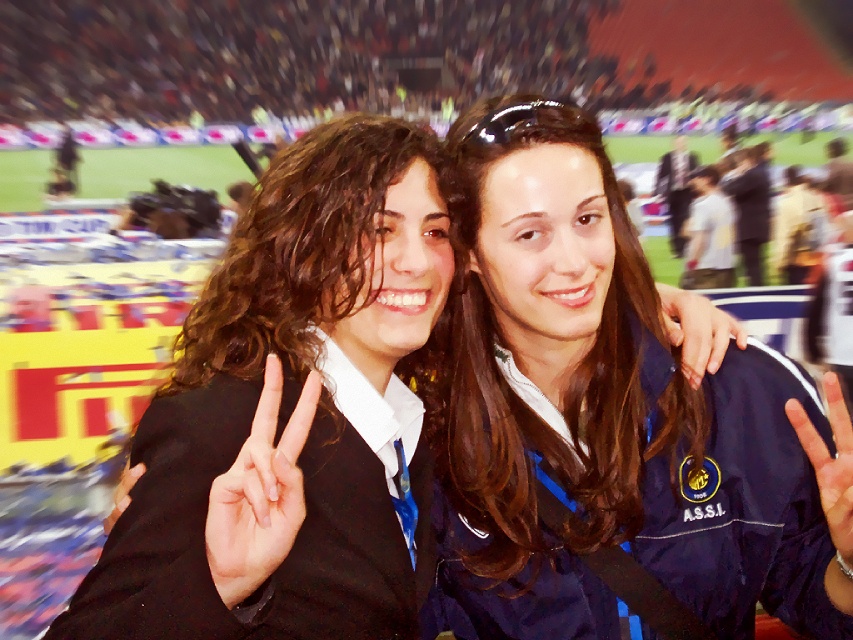
Which of these two, white matte hand at center or matte black hand at center, stands shorter?

With less height is matte black hand at center.

Does white matte hand at center have a lesser height compared to matte black hand at center?

No.

Locate an element on the screen. The height and width of the screenshot is (640, 853). white matte hand at center is located at coordinates (259, 492).

At what (x,y) coordinates should I click in order to perform the action: click on white matte hand at center. Please return your answer as a coordinate pair (x, y). Looking at the image, I should click on (259, 492).

Is blue fabric jacket at center smaller than light skin hand at center?

No.

Does blue fabric jacket at center appear over light skin hand at center?

Yes, blue fabric jacket at center is above light skin hand at center.

Which is behind, point (509, 614) or point (838, 461)?

Positioned behind is point (509, 614).

Locate an element on the screen. blue fabric jacket at center is located at coordinates coord(612,417).

Is black matte blazer at center wider than light skin hand at center?

Correct, the width of black matte blazer at center exceeds that of light skin hand at center.

Can you confirm if black matte blazer at center is bigger than light skin hand at center?

Indeed, black matte blazer at center has a larger size compared to light skin hand at center.

Does point (315, 499) come closer to viewer compared to point (842, 420)?

No, (315, 499) is behind (842, 420).

I want to click on black matte blazer at center, so click(280, 563).